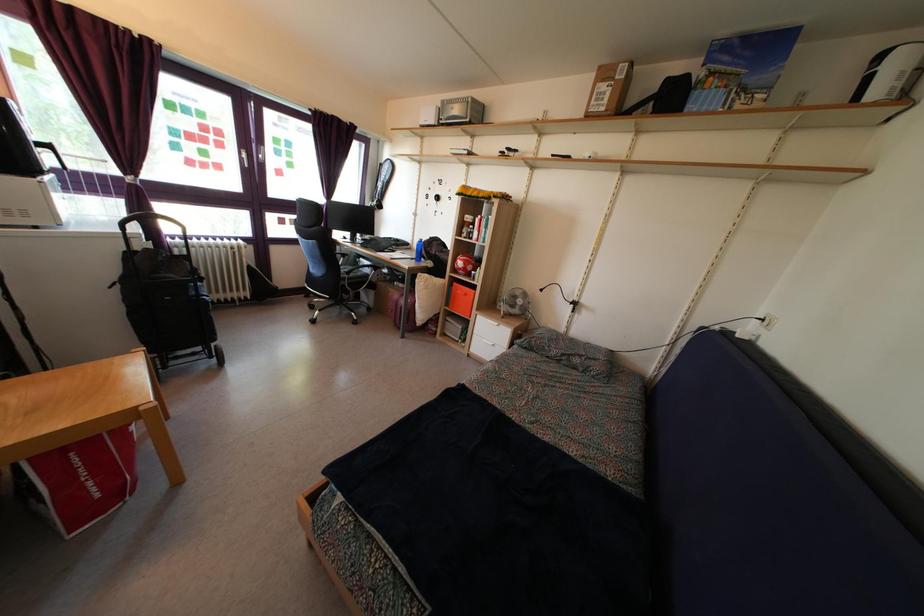
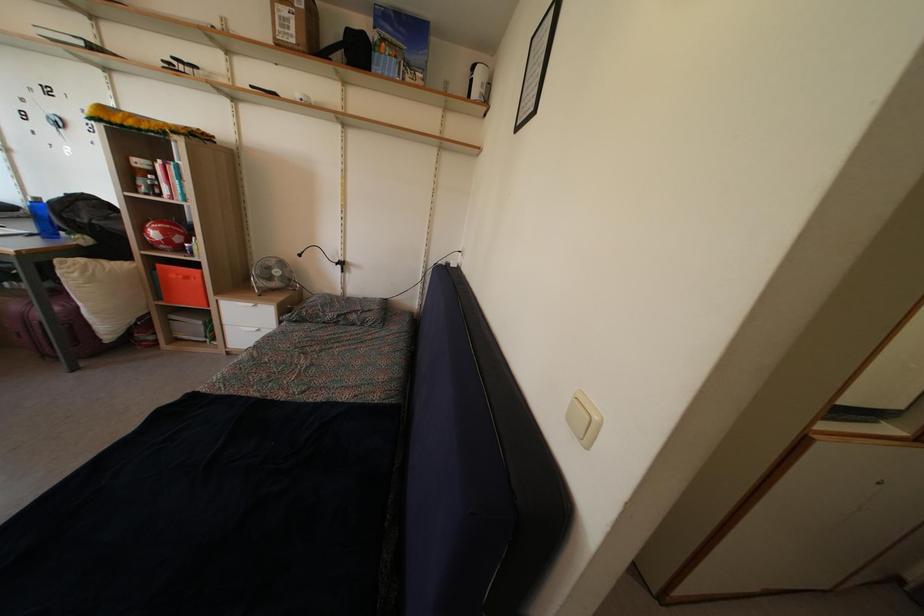
Locate, in the second image, the point that corresponds to (565,339) in the first image.

(342, 301)